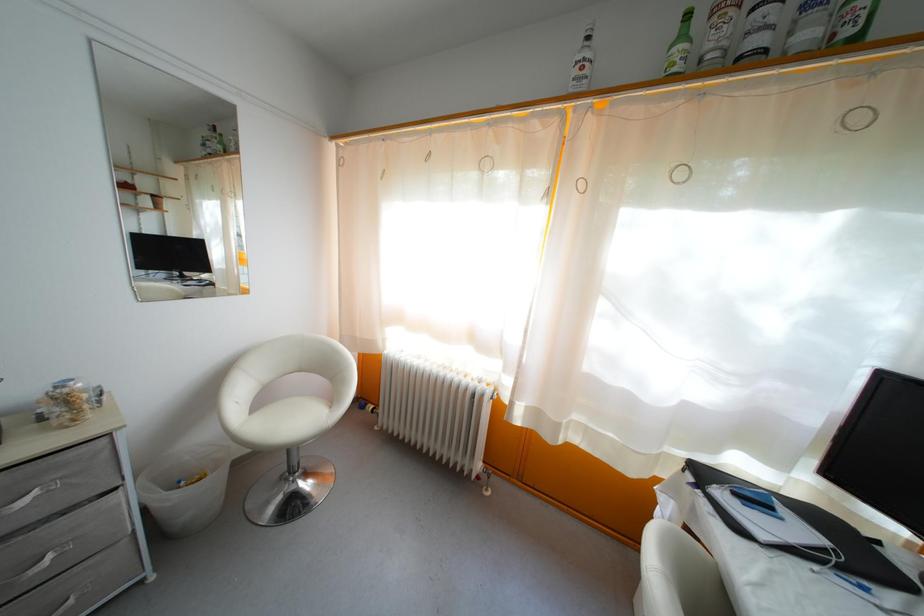
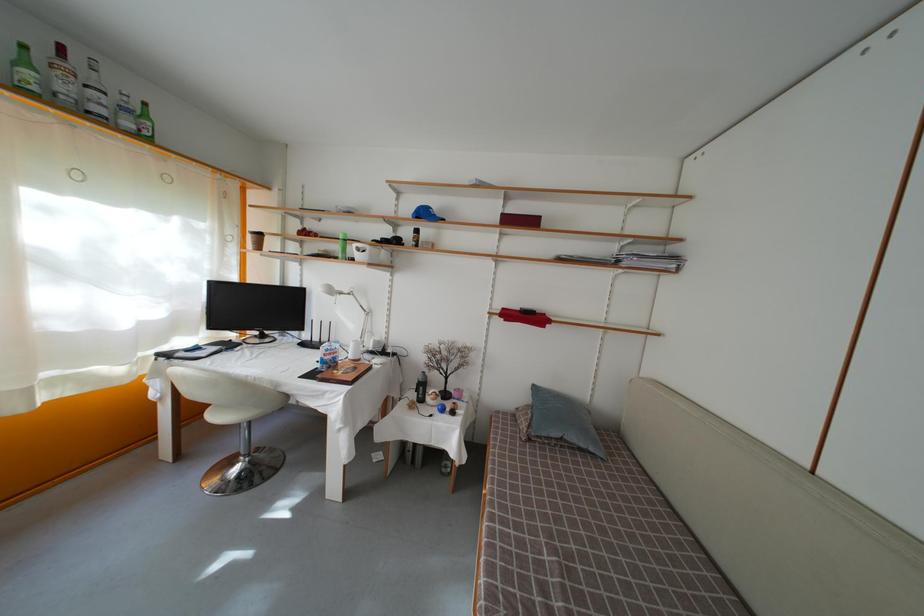
In the second image, find the point that corresponds to the point at 688,43 in the first image.

(31, 69)